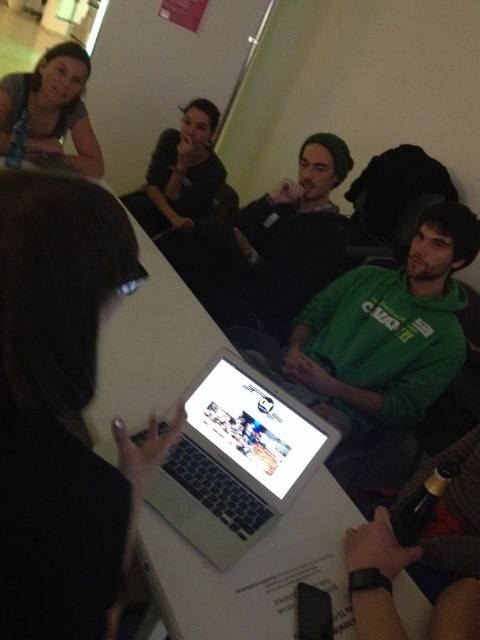
Question: Which of these objects is positioned closest to the silver metallic laptop at center?

Choices:
 (A) black matte laptop at center
 (B) matte gray shirt at upper left

Answer: (A)

Question: Which point is closer to the camera?

Choices:
 (A) (224, 445)
 (B) (285, 244)
 (C) (84, 80)
 (D) (179, 454)

Answer: (D)

Question: Does black matte laptop at center lie in front of black knit cap at center?

Choices:
 (A) no
 (B) yes

Answer: (B)

Question: Does silver metallic laptop at center appear on the right side of matte gray shirt at upper left?

Choices:
 (A) yes
 (B) no

Answer: (A)

Question: Which object is the farthest from the white glossy laptop at center?

Choices:
 (A) black knit cap at center
 (B) white glossy table at center

Answer: (A)

Question: Does black matte laptop at center have a larger size compared to silver metallic laptop at center?

Choices:
 (A) no
 (B) yes

Answer: (A)